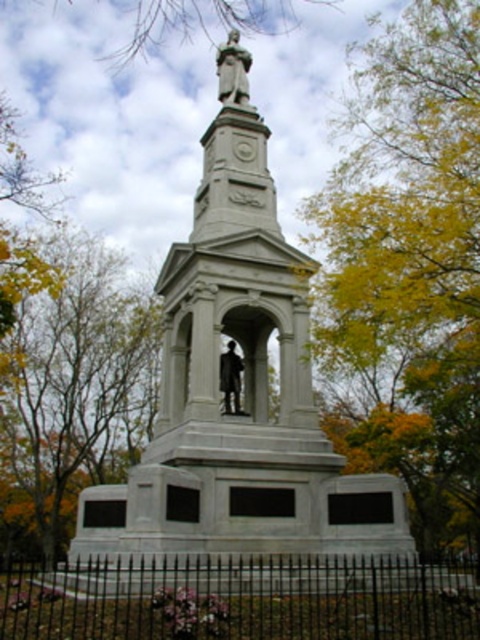
You are a photographer trying to capture both the white marble statue at center and the yellow leafy tree at upper center in a single frame. Based on their sizes, which one should you focus on to ensure both are visible without cropping?

Since the white marble statue at center is smaller than the yellow leafy tree at upper center, you should focus on the white marble statue at center to ensure both are visible without cropping.